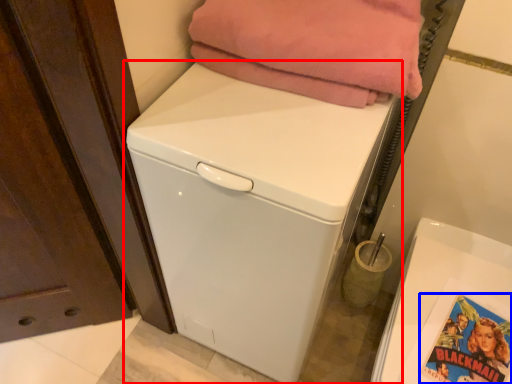
Question: Which point is further to the camera, washing machine (highlighted by a red box) or comic book (highlighted by a blue box)?

Choices:
 (A) washing machine
 (B) comic book

Answer: (B)